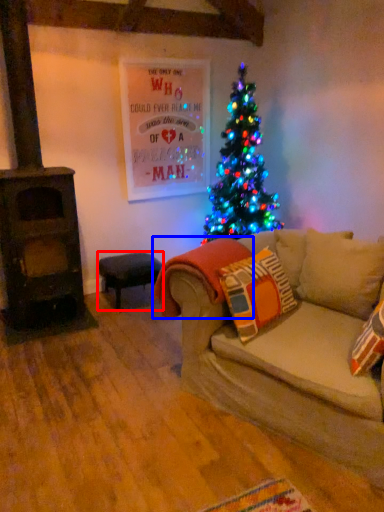
Question: Which object is closer to the camera taking this photo, stool (highlighted by a red box) or blanket (highlighted by a blue box)?

Choices:
 (A) stool
 (B) blanket

Answer: (B)